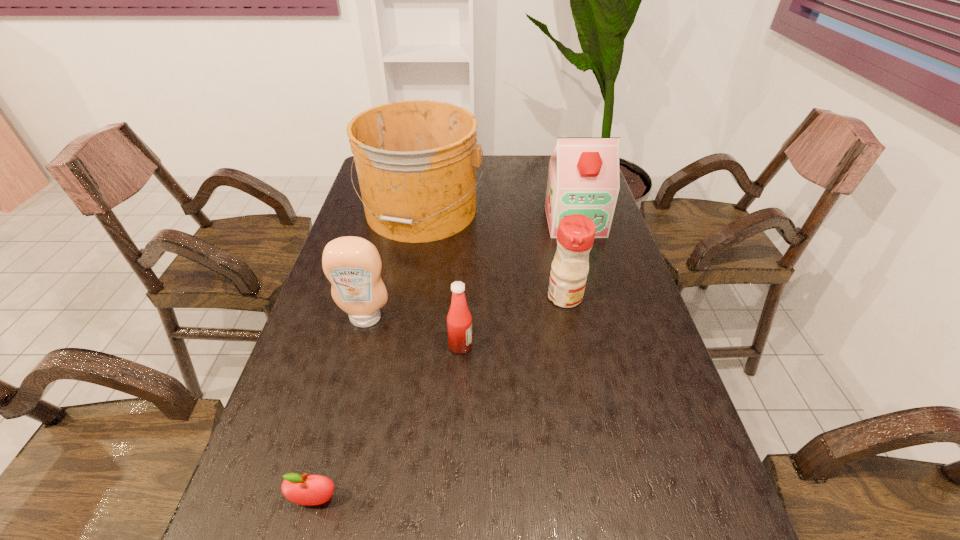
Locate an element on the screen. object that is at the far left corner is located at coordinates (416, 160).

In the image, there is a desktop. Find the location of `free region at the left edge`. free region at the left edge is located at coordinates (337, 448).

The height and width of the screenshot is (540, 960). Find the location of `vacant space at the right edge`. vacant space at the right edge is located at coordinates (614, 350).

Image resolution: width=960 pixels, height=540 pixels. I want to click on blank region between the bucket and the leftmost condiment, so click(x=393, y=265).

Image resolution: width=960 pixels, height=540 pixels. I want to click on free spot between the shortest object and the rightmost condiment, so click(440, 399).

You are a GUI agent. You are given a task and a screenshot of the screen. Output one action in this format:
    pyautogui.click(x=<x>, y=<y>)
    Task: Click on the empty space between the second nearest object and the bucket
    
    Given the screenshot: What is the action you would take?
    tap(441, 278)

Identify the location of free space between the leftmost condiment and the nearest object. (341, 409).

Where is `free space between the rightmost condiment and the nearest object`? free space between the rightmost condiment and the nearest object is located at coordinates (440, 399).

You are a GUI agent. You are given a task and a screenshot of the screen. Output one action in this format:
    pyautogui.click(x=<x>, y=<y>)
    Task: Click on the vacant space in between the shortest object and the bucket
    
    Given the screenshot: What is the action you would take?
    pyautogui.click(x=368, y=355)

Image resolution: width=960 pixels, height=540 pixels. What are the coordinates of `empty location between the second nearest object and the shortest object` in the screenshot? It's located at (388, 423).